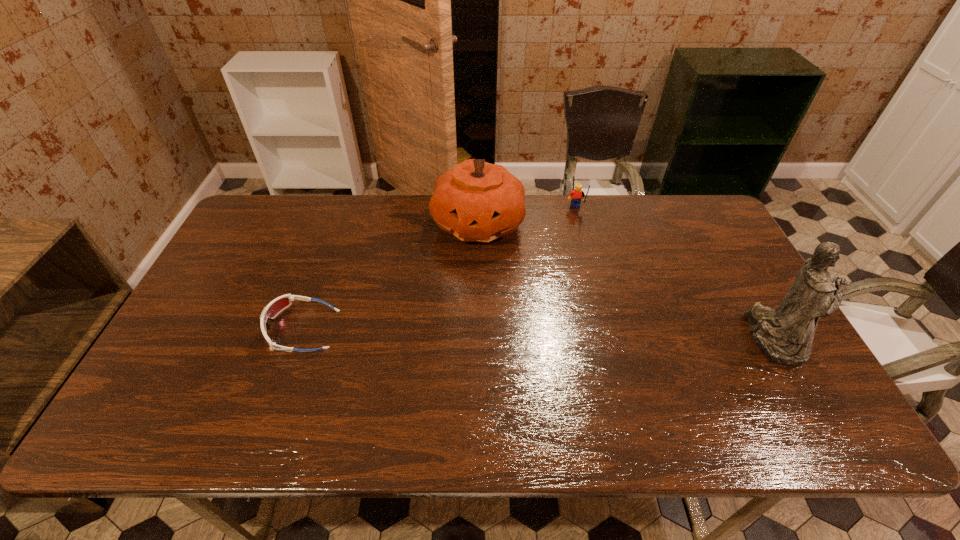
The height and width of the screenshot is (540, 960). Find the location of `vacant space located 0.190m on the front-facing side of the leftmost object`. vacant space located 0.190m on the front-facing side of the leftmost object is located at coordinates (196, 329).

I want to click on vacant area situated 0.220m on the front-facing side of the third object from right to left, so point(509,307).

Identify the location of free space located 0.400m on the front-facing side of the third object from right to left. The width and height of the screenshot is (960, 540). (529, 361).

Identify the location of vacant space located on the front-facing side of the third object from right to left. This screenshot has height=540, width=960. (524, 348).

The height and width of the screenshot is (540, 960). In order to click on free space located on the front-facing side of the second object from right to left in this screenshot , I will do `click(585, 264)`.

Identify the location of vacant space situated on the front-facing side of the second object from right to left. The height and width of the screenshot is (540, 960). (588, 288).

This screenshot has height=540, width=960. I want to click on vacant space located on the front-facing side of the second object from right to left, so click(584, 258).

I want to click on pumpkin that is at the far edge, so 476,201.

The image size is (960, 540). I want to click on Lego at the far edge, so (577, 194).

I want to click on object present at the near edge, so click(785, 335).